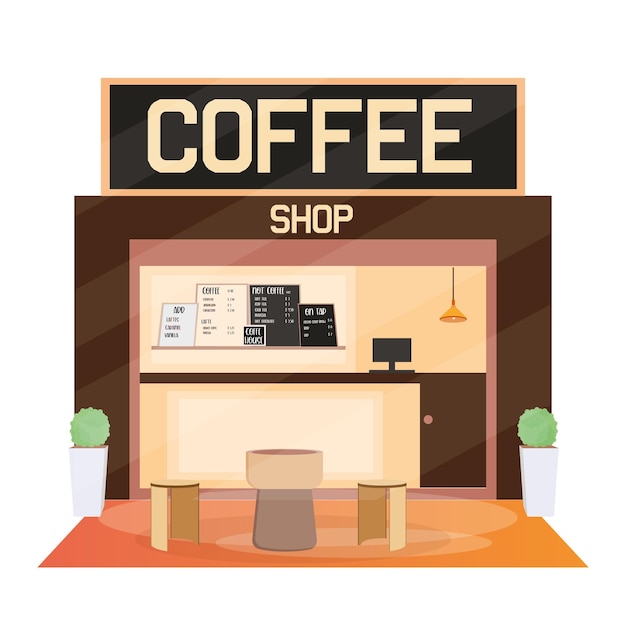
Identify the location of stools. (394, 481), (178, 485).